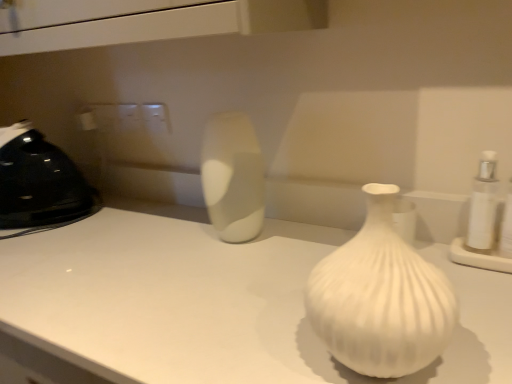
I want to click on vacant area that lies in front of satin white vase at center, which is the second vase from front to back, so click(x=240, y=271).